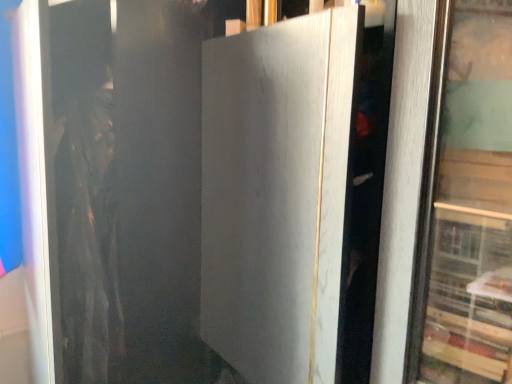
Measure the distance between white marble door at center and camera.

white marble door at center and camera are 22.88 inches apart from each other.

Locate an element on the screen. white marble door at center is located at coordinates (277, 194).

Image resolution: width=512 pixels, height=384 pixels. Describe the element at coordinates (277, 194) in the screenshot. I see `white marble door at center` at that location.

What is the approximate width of white marble door at center?

18.47 inches.

The width and height of the screenshot is (512, 384). Identify the location of white marble door at center. (277, 194).